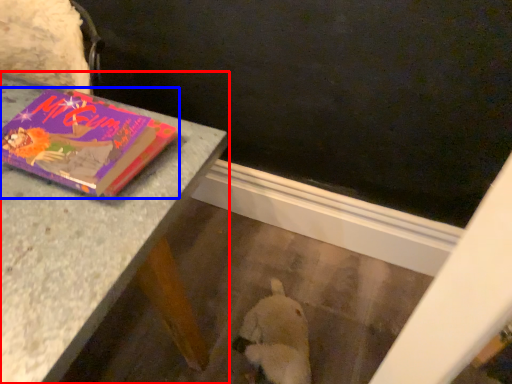
Question: Which object is further to the camera taking this photo, table (highlighted by a red box) or book (highlighted by a blue box)?

Choices:
 (A) table
 (B) book

Answer: (A)